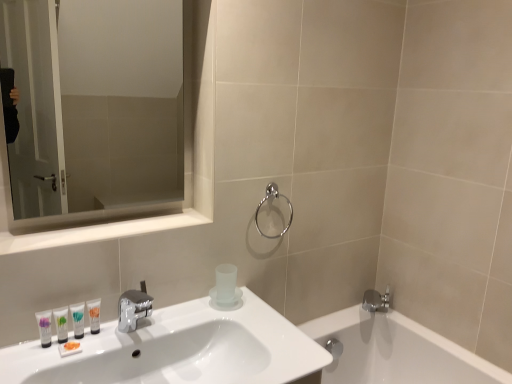
Question: Is white glossy tube at lower left, which appears as the third mouthwash when viewed from the right, at the left side of clear glass mirror at upper left?

Choices:
 (A) yes
 (B) no

Answer: (A)

Question: Can you confirm if white glossy tube at lower left, which appears as the third mouthwash when viewed from the right, is wider than clear glass mirror at upper left?

Choices:
 (A) no
 (B) yes

Answer: (B)

Question: Is white glossy tube at lower left, which appears as the third mouthwash when viewed from the right, aimed at clear glass mirror at upper left?

Choices:
 (A) yes
 (B) no

Answer: (B)

Question: Is white glossy tube at lower left, which ranks as the second mouthwash in left-to-right order, positioned with its back to clear glass mirror at upper left?

Choices:
 (A) yes
 (B) no

Answer: (B)

Question: Is white glossy tube at lower left, which ranks as the second mouthwash in left-to-right order, not near clear glass mirror at upper left?

Choices:
 (A) yes
 (B) no

Answer: (A)

Question: Is white glossy sink at lower left taller or shorter than clear glass mirror at upper left?

Choices:
 (A) tall
 (B) short

Answer: (B)

Question: Would you say white glossy sink at lower left is inside or outside clear glass mirror at upper left?

Choices:
 (A) inside
 (B) outside

Answer: (B)

Question: Is white glossy sink at lower left to the left or to the right of clear glass mirror at upper left in the image?

Choices:
 (A) right
 (B) left

Answer: (A)

Question: Is white glossy sink at lower left in front of or behind clear glass mirror at upper left in the image?

Choices:
 (A) behind
 (B) front

Answer: (B)

Question: Is polished chrome towel ring at upper center taller or shorter than white glossy tube at lower left, the third mouthwash when ordered from left to right?

Choices:
 (A) short
 (B) tall

Answer: (B)

Question: In terms of width, does polished chrome towel ring at upper center look wider or thinner when compared to white glossy tube at lower left, placed as the 2th mouthwash when sorted from right to left?

Choices:
 (A) wide
 (B) thin

Answer: (A)

Question: Do you think polished chrome towel ring at upper center is within white glossy tube at lower left, placed as the 2th mouthwash when sorted from right to left, or outside of it?

Choices:
 (A) outside
 (B) inside

Answer: (A)

Question: In the image, is polished chrome towel ring at upper center positioned in front of or behind white glossy tube at lower left, placed as the 2th mouthwash when sorted from right to left?

Choices:
 (A) front
 (B) behind

Answer: (B)

Question: Looking at their shapes, would you say white glossy mirror at upper left is wider or thinner than polished chrome towel ring at upper center?

Choices:
 (A) thin
 (B) wide

Answer: (B)

Question: Considering the positions of white glossy mirror at upper left and polished chrome towel ring at upper center in the image, is white glossy mirror at upper left taller or shorter than polished chrome towel ring at upper center?

Choices:
 (A) short
 (B) tall

Answer: (A)